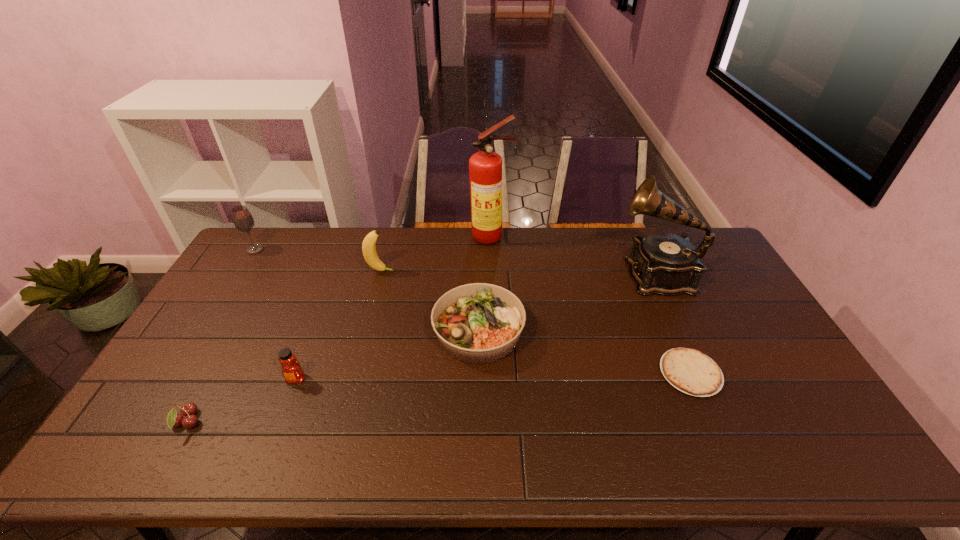
This screenshot has width=960, height=540. Find the location of `vacant space located on the front-facing side of the tallest object`. vacant space located on the front-facing side of the tallest object is located at coordinates (494, 318).

Identify the location of vacant space located on the horn of the second tallest object. The width and height of the screenshot is (960, 540). (531, 274).

I want to click on vacant space located 0.200m on the horn of the second tallest object, so click(x=560, y=274).

The image size is (960, 540). Find the location of `vacant space located 0.350m on the horn of the second tallest object`. vacant space located 0.350m on the horn of the second tallest object is located at coordinates (516, 274).

Where is `blank area located 0.280m on the front of the leftmost object`? blank area located 0.280m on the front of the leftmost object is located at coordinates (218, 309).

This screenshot has height=540, width=960. Identify the location of vacant region located 0.270m from the stem of the fourth object from left to right. (471, 271).

Where is `blank space located 0.110m on the front label of the fourth shortest object`? This screenshot has height=540, width=960. blank space located 0.110m on the front label of the fourth shortest object is located at coordinates (278, 423).

Locate an element on the screen. The height and width of the screenshot is (540, 960). vacant region located 0.060m on the front of the salad plate is located at coordinates (478, 387).

Identify the location of blank space located on the leaves of the nearest object. The image size is (960, 540). (352, 422).

The width and height of the screenshot is (960, 540). What are the coordinates of `free space located 0.110m on the right of the shortest object` in the screenshot? It's located at (760, 373).